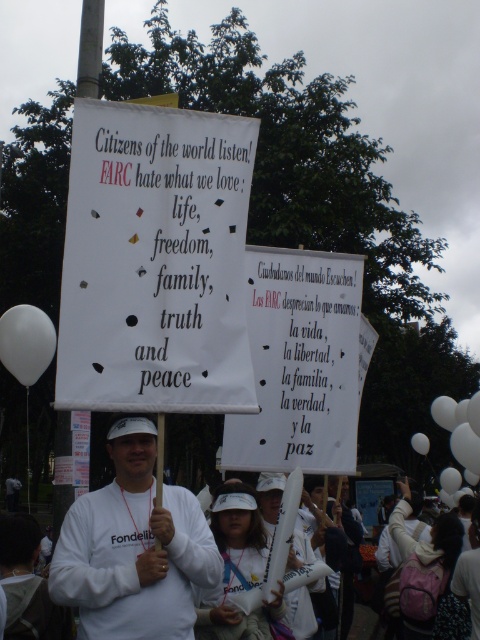
Who is taller, white paper sign at center or white matte balloon at lower left?

white paper sign at center

Which is behind, point (213, 276) or point (36, 369)?

The point (36, 369) is more distant.

Where is `white paper sign at center`? white paper sign at center is located at coordinates (156, 260).

Who is positioned more to the right, white matte balloon at lower left or white balloon at center?

Positioned to the right is white balloon at center.

Describe the element at coordinates (25, 342) in the screenshot. I see `white matte balloon at lower left` at that location.

You are a GUI agent. You are given a task and a screenshot of the screen. Output one action in this format:
    pyautogui.click(x=<x>, y=<y>)
    Task: Click on the white matte balloon at lower left
    The height and width of the screenshot is (640, 480).
    Given the screenshot: What is the action you would take?
    click(x=25, y=342)

Can you confirm if white paper sign at center is taller than white matte shirt at center?

Yes, white paper sign at center is taller than white matte shirt at center.

Is white paper sign at center above white matte shirt at center?

Yes, white paper sign at center is above white matte shirt at center.

Where is `white paper sign at center`? white paper sign at center is located at coordinates (156, 260).